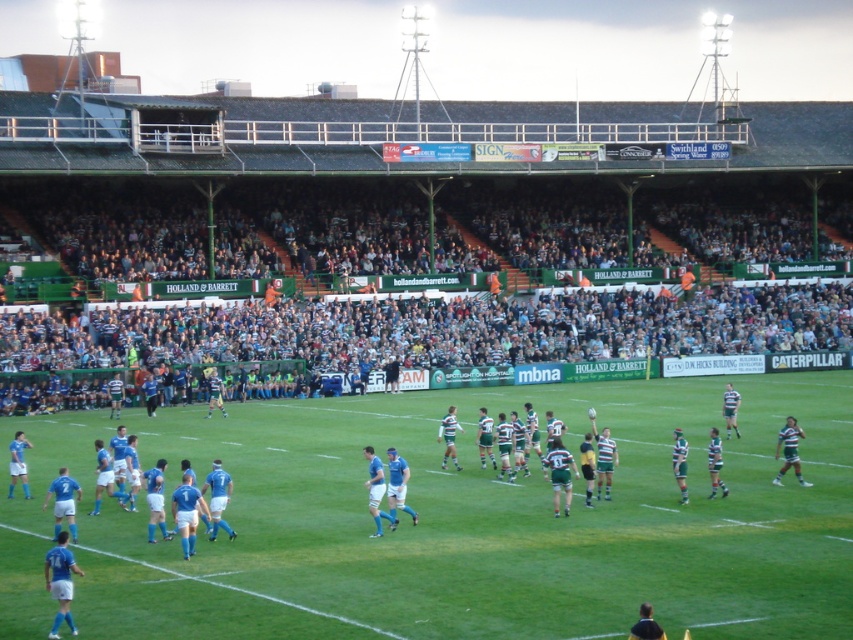
You are a drone operator trying to capture aerial footage of the rugby match. You need to fly your drone from the dark gray crowd at upper center to the green grass field at center. Can your drone safely descend vertically without hitting any obstacles?

The green grass field at center is positioned under dark gray crowd at upper center, so yes, the drone can safely descend vertically from the dark gray crowd at upper center to the green grass field at center without encountering obstacles.

You are a photographer standing at the edge of the field. You want to take a photo that includes both the green grass field at center and the dark gray crowd at upper center. Which object will appear larger in your photo?

The green grass field at center will appear larger in the photo because it is closer to the viewer than the dark gray crowd at upper center.